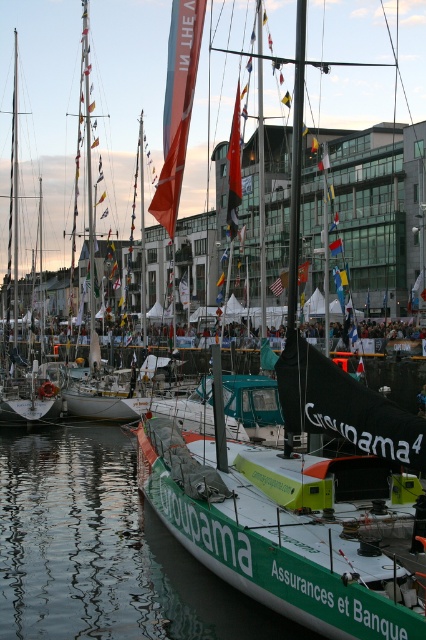
Which is below, green matte sailboat at center or white matte sailboat at left?

green matte sailboat at center is lower down.

What do you see at coordinates (296, 486) in the screenshot?
I see `green matte sailboat at center` at bounding box center [296, 486].

Locate an element on the screen. green matte sailboat at center is located at coordinates tap(296, 486).

Can you confirm if green smooth water at lower left is taller than white matte sailboat at left?

No.

Looking at this image, does green smooth water at lower left appear on the right side of white matte sailboat at left?

Yes, green smooth water at lower left is to the right of white matte sailboat at left.

Between point (115, 525) and point (5, 332), which one is positioned behind?

Positioned behind is point (5, 332).

Image resolution: width=426 pixels, height=640 pixels. What are the coordinates of `green smooth water at lower left` in the screenshot? It's located at (103, 550).

Between green matte sailboat at center and green smooth water at lower left, which one appears on the left side from the viewer's perspective?

green smooth water at lower left is more to the left.

Can you confirm if green matte sailboat at center is positioned above green smooth water at lower left?

Correct, green matte sailboat at center is located above green smooth water at lower left.

Locate an element on the screen. This screenshot has width=426, height=640. green matte sailboat at center is located at coordinates (296, 486).